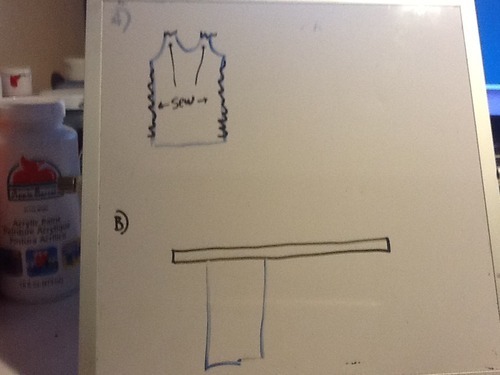
Identify the location of light gray bowl. (73, 67).